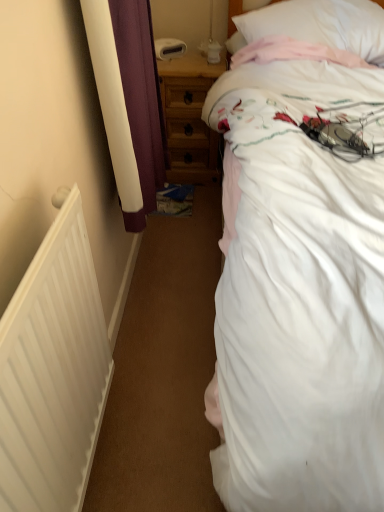
The height and width of the screenshot is (512, 384). Find the location of `free space above wooden nightstand at center (from a real-world perspective)`. free space above wooden nightstand at center (from a real-world perspective) is located at coordinates (185, 57).